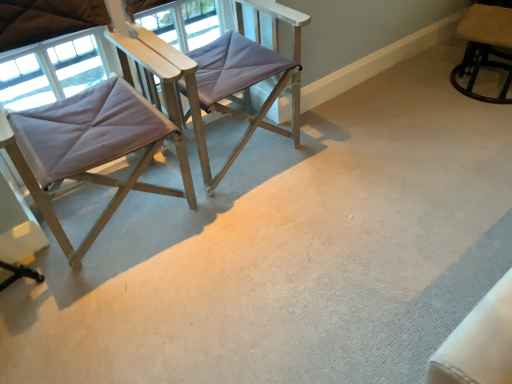
Where is `free space in front of matte purple fabric chair at center, marked as the second chair in a left-to-right arrangement`? free space in front of matte purple fabric chair at center, marked as the second chair in a left-to-right arrangement is located at coordinates (257, 249).